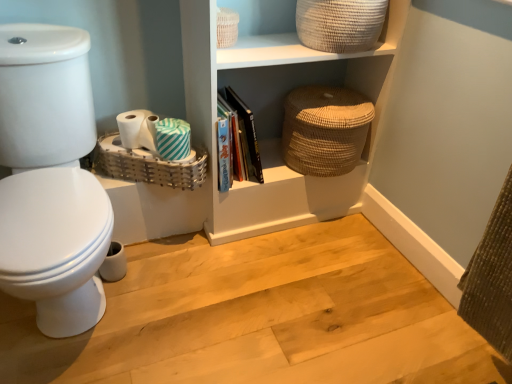
Describe the element at coordinates (260, 317) in the screenshot. I see `wooden floor at lower left` at that location.

What do you see at coordinates (244, 132) in the screenshot? I see `hardcover books at center` at bounding box center [244, 132].

Identify the location of hardcover books at center. This screenshot has height=384, width=512. (244, 132).

The width and height of the screenshot is (512, 384). Find the location of `teal striped toilet paper at center, the second toilet paper from the left`. teal striped toilet paper at center, the second toilet paper from the left is located at coordinates (148, 133).

Where is `woven beige basket at upper right, the first basket viewed from the right`? The width and height of the screenshot is (512, 384). woven beige basket at upper right, the first basket viewed from the right is located at coordinates (325, 129).

Is teal striped toilet paper at center, arranged as the 2th toilet paper when viewed from the right, wider than natural woven basket at upper right?

Incorrect, the width of teal striped toilet paper at center, arranged as the 2th toilet paper when viewed from the right, does not surpass that of natural woven basket at upper right.

From the image's perspective, is teal striped toilet paper at center, arranged as the 2th toilet paper when viewed from the right, under natural woven basket at upper right?

Yes, from the image's perspective, teal striped toilet paper at center, arranged as the 2th toilet paper when viewed from the right, is below natural woven basket at upper right.

From a real-world perspective, is teal striped toilet paper at center, the second toilet paper from the left, above or below natural woven basket at upper right?

Clearly, from a real-world perspective, teal striped toilet paper at center, the second toilet paper from the left, is below natural woven basket at upper right.

Considering the sizes of objects teal striped toilet paper at center, the second toilet paper from the left, and natural woven basket at upper right in the image provided, who is smaller, teal striped toilet paper at center, the second toilet paper from the left, or natural woven basket at upper right?

teal striped toilet paper at center, the second toilet paper from the left.

Where is `stair that is below the beige woven basket at upper center, the 2th basket from the right (from the image's perspective)`? The image size is (512, 384). stair that is below the beige woven basket at upper center, the 2th basket from the right (from the image's perspective) is located at coordinates (260, 317).

Which is more to the right, beige woven basket at upper center, which is the 2th basket from left to right, or wooden floor at lower left?

Positioned to the right is beige woven basket at upper center, which is the 2th basket from left to right.

How far apart are beige woven basket at upper center, the 2th basket from the right, and wooden floor at lower left?

36.68 inches.

From a real-world perspective, between beige woven basket at upper center, which is the 2th basket from left to right, and wooden floor at lower left, who is vertically lower?

From a 3D spatial view, wooden floor at lower left is below.

Where is `toilet paper that is the 3rd one when counting downward from the beige woven basket at upper center, the 2th basket from the right (from the image's perspective)`? This screenshot has width=512, height=384. toilet paper that is the 3rd one when counting downward from the beige woven basket at upper center, the 2th basket from the right (from the image's perspective) is located at coordinates (173, 138).

Is teal striped toilet paper at center, arranged as the first toilet paper when viewed from the right, surrounded by beige woven basket at upper center, the 2th basket from the right?

No, teal striped toilet paper at center, arranged as the first toilet paper when viewed from the right, is located outside of beige woven basket at upper center, the 2th basket from the right.

How different are the orientations of beige woven basket at upper center, which is the 2th basket from left to right, and teal striped toilet paper at center, which is counted as the third toilet paper, starting from the left, in degrees?

The facing directions of beige woven basket at upper center, which is the 2th basket from left to right, and teal striped toilet paper at center, which is counted as the third toilet paper, starting from the left, are 8.12 degrees apart.

In the scene shown: Could you tell me if beige woven basket at upper center, the 2th basket from the right, is turned towards teal striped toilet paper at center, which is counted as the third toilet paper, starting from the left?

No, beige woven basket at upper center, the 2th basket from the right, is not facing towards teal striped toilet paper at center, which is counted as the third toilet paper, starting from the left.

How distant is wooden floor at lower left from beige woven basket at upper center, the 2th basket from the right?

They are 93.17 centimeters apart.

Which of these two, wooden floor at lower left or beige woven basket at upper center, the 2th basket from the right, stands taller?

beige woven basket at upper center, the 2th basket from the right.

Can you confirm if wooden floor at lower left is wider than beige woven basket at upper center, which is the 2th basket from left to right?

Indeed, wooden floor at lower left has a greater width compared to beige woven basket at upper center, which is the 2th basket from left to right.

From a real-world perspective, is wooden floor at lower left on beige woven basket at upper center, which is the 2th basket from left to right?

No, from a real-world perspective, wooden floor at lower left is not over beige woven basket at upper center, which is the 2th basket from left to right

Consider the image. Is white matte toilet paper at lower left, which ranks as the 1th toilet paper in left-to-right order, further to camera compared to teal striped toilet paper at center, arranged as the 2th toilet paper when viewed from the right?

No, white matte toilet paper at lower left, which ranks as the 1th toilet paper in left-to-right order, is closer to the camera.

From a real-world perspective, which object rests below the other?

From a 3D spatial view, teal striped toilet paper at center, arranged as the 2th toilet paper when viewed from the right, is below.

Find the location of a particular element. toilet paper on the left of the teal striped toilet paper at center, arranged as the 2th toilet paper when viewed from the right is located at coordinates (138, 129).

Does white matte toilet paper at lower left, which ranks as the 1th toilet paper in left-to-right order, have a greater width compared to teal striped toilet paper at center, arranged as the 2th toilet paper when viewed from the right?

Indeed, white matte toilet paper at lower left, which ranks as the 1th toilet paper in left-to-right order, has a greater width compared to teal striped toilet paper at center, arranged as the 2th toilet paper when viewed from the right.

Consider the image. Is wooden floor at lower left next to white matte toilet paper at lower left, which ranks as the 1th toilet paper in left-to-right order, and touching it?

There is a gap between wooden floor at lower left and white matte toilet paper at lower left, which ranks as the 1th toilet paper in left-to-right order.

Could you tell me if wooden floor at lower left is facing white matte toilet paper at lower left, which appears as the 3th toilet paper when viewed from the right?

No, wooden floor at lower left is not turned towards white matte toilet paper at lower left, which appears as the 3th toilet paper when viewed from the right.

Between wooden floor at lower left and white matte toilet paper at lower left, which ranks as the 1th toilet paper in left-to-right order, which one appears on the right side from the viewer's perspective?

wooden floor at lower left is more to the right.

Considering the relative sizes of wooden floor at lower left and white matte toilet paper at lower left, which ranks as the 1th toilet paper in left-to-right order, in the image provided, is wooden floor at lower left smaller than white matte toilet paper at lower left, which ranks as the 1th toilet paper in left-to-right order,?

Incorrect, wooden floor at lower left is not smaller in size than white matte toilet paper at lower left, which ranks as the 1th toilet paper in left-to-right order.

Is natural woven basket at upper right facing towards wooden floor at lower left?

Yes, natural woven basket at upper right is turned towards wooden floor at lower left.

How far apart are natural woven basket at upper right and wooden floor at lower left?

A distance of 19.09 inches exists between natural woven basket at upper right and wooden floor at lower left.

Can wooden floor at lower left be found inside natural woven basket at upper right?

No, wooden floor at lower left is located outside of natural woven basket at upper right.

You are a GUI agent. You are given a task and a screenshot of the screen. Output one action in this format:
    pyautogui.click(x=<x>, y=<y>)
    Task: Click on the shelf located above the teal striped toilet paper at center, arranged as the 2th toilet paper when viewed from the right (from the image's perspective)
    The width and height of the screenshot is (512, 384).
    Given the screenshot: What is the action you would take?
    pyautogui.click(x=276, y=117)

I want to click on the 1st basket to the right of the wooden floor at lower left, counting from the anchor's position, so 340,24.

Which object lies further to the anchor point hardcover books at center, natural woven basket at upper right or teal striped toilet paper at center, which is counted as the third toilet paper, starting from the left?

teal striped toilet paper at center, which is counted as the third toilet paper, starting from the left, is positioned further to the anchor hardcover books at center.

Which object lies nearer to the anchor point woven beige basket at upper right, the 3th basket when ordered from left to right, hardcover books at center or teal striped toilet paper at center, the second toilet paper from the left?

The object closer to woven beige basket at upper right, the 3th basket when ordered from left to right, is hardcover books at center.

Looking at the image, which one is located further to teal striped toilet paper at center, which is counted as the third toilet paper, starting from the left, white matte toilet paper at lower left, which ranks as the 1th toilet paper in left-to-right order, or hardcover books at center?

Among the two, hardcover books at center is located further to teal striped toilet paper at center, which is counted as the third toilet paper, starting from the left.

From the image, which object appears to be farther from woven beige basket at upper right, the first basket viewed from the right, white matte toilet paper at lower left, which appears as the 3th toilet paper when viewed from the right, or teal striped toilet paper at center, arranged as the first toilet paper when viewed from the right?

Among the two, white matte toilet paper at lower left, which appears as the 3th toilet paper when viewed from the right, is located further to woven beige basket at upper right, the first basket viewed from the right.

Looking at the image, which one is located further to white matte toilet paper at lower left, which appears as the 3th toilet paper when viewed from the right, teal striped toilet paper at center, the second toilet paper from the left, or beige woven basket at upper center, which is the 2th basket from left to right?

beige woven basket at upper center, which is the 2th basket from left to right, is further to white matte toilet paper at lower left, which appears as the 3th toilet paper when viewed from the right.

From the image, which object appears to be nearer to hardcover books at center, teal striped toilet paper at center, which is counted as the third toilet paper, starting from the left, or natural woven basket at upper right?

natural woven basket at upper right lies closer to hardcover books at center than the other object.

Estimate the real-world distances between objects in this image. Which object is closer to teal striped toilet paper at center, the second toilet paper from the left, beige woven basket at upper center, which is the 2th basket from left to right, or hardcover books at center?

hardcover books at center is positioned closer to the anchor teal striped toilet paper at center, the second toilet paper from the left.

When comparing their distances from teal striped toilet paper at center, arranged as the first toilet paper when viewed from the right, does woven wicker basket at lower left, the first basket viewed from the left, or hardcover books at center seem closer?

woven wicker basket at lower left, the first basket viewed from the left, is positioned closer to the anchor teal striped toilet paper at center, arranged as the first toilet paper when viewed from the right.

Identify the location of book between teal striped toilet paper at center, arranged as the first toilet paper when viewed from the right, and beige woven basket at upper center, which is the 2th basket from left to right, from left to right. Image resolution: width=512 pixels, height=384 pixels. (244, 132).

You are a GUI agent. You are given a task and a screenshot of the screen. Output one action in this format:
    pyautogui.click(x=<x>, y=<y>)
    Task: Click on the toilet paper situated between teal striped toilet paper at center, the second toilet paper from the left, and hardcover books at center from left to right
    The width and height of the screenshot is (512, 384).
    Given the screenshot: What is the action you would take?
    pyautogui.click(x=173, y=138)

Locate an element on the screen. The width and height of the screenshot is (512, 384). book between woven wicker basket at lower left, which ranks as the third basket in right-to-left order, and beige woven basket at upper center, the 2th basket from the right, in the horizontal direction is located at coordinates (244, 132).

This screenshot has width=512, height=384. Find the location of `book between teal striped toilet paper at center, arranged as the 2th toilet paper when viewed from the right, and woven beige basket at upper right, the first basket viewed from the right`. book between teal striped toilet paper at center, arranged as the 2th toilet paper when viewed from the right, and woven beige basket at upper right, the first basket viewed from the right is located at coordinates (244, 132).